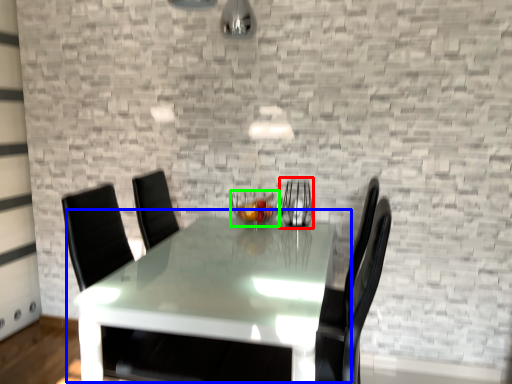
Question: Which is nearer to the glass vase (highlighted by a red box)? table (highlighted by a blue box) or candle holder (highlighted by a green box).

Choices:
 (A) table
 (B) candle holder

Answer: (B)